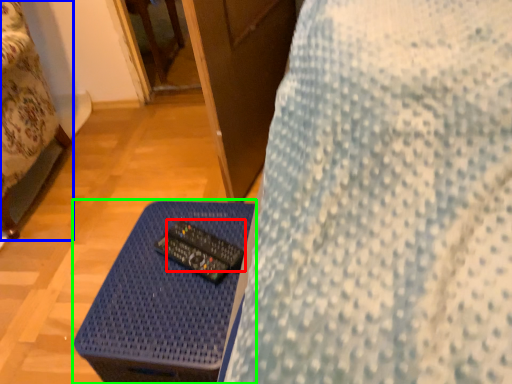
Question: Based on their relative distances, which object is farther from control (highlighted by a red box)? Choose from furniture (highlighted by a blue box) and table (highlighted by a green box).

Choices:
 (A) furniture
 (B) table

Answer: (A)